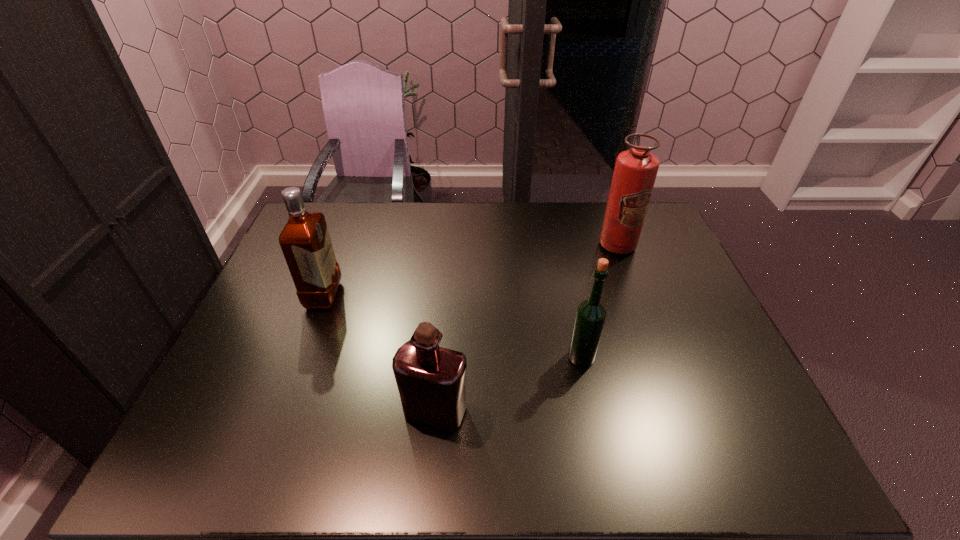
Identify which object is the third closest to the rightmost liquor. Please provide its 2D coordinates. Your answer should be formatted as a tuple, i.e. [(x, y)], where the tuple contains the x and y coordinates of a point satisfying the conditions above.

[(305, 241)]

Locate which object ranks third in proximity to the farthest object. Please provide its 2D coordinates. Your answer should be formatted as a tuple, i.e. [(x, y)], where the tuple contains the x and y coordinates of a point satisfying the conditions above.

[(305, 241)]

Where is `the closest liquor to the leftmost object`? The height and width of the screenshot is (540, 960). the closest liquor to the leftmost object is located at coordinates (431, 380).

Where is `liquor identified as the second closest to the third object from left to right`? The image size is (960, 540). liquor identified as the second closest to the third object from left to right is located at coordinates (305, 241).

The width and height of the screenshot is (960, 540). I want to click on free region that satisfies the following two spatial constraints: 1. on the front label of the leftmost liquor; 2. on the back side of the third object from left to right, so [x=300, y=357].

Identify the location of vacant area in the image that satisfies the following two spatial constraints: 1. on the label side of the fire extinguisher; 2. on the front label of the leftmost object. (636, 295).

Where is `free space that satisfies the following two spatial constraints: 1. on the front label of the rightmost liquor; 2. on the left side of the leftmost liquor`? This screenshot has height=540, width=960. free space that satisfies the following two spatial constraints: 1. on the front label of the rightmost liquor; 2. on the left side of the leftmost liquor is located at coordinates coord(300,357).

Locate an element on the screen. Image resolution: width=960 pixels, height=540 pixels. free space that satisfies the following two spatial constraints: 1. on the front label of the leftmost liquor; 2. on the left side of the second nearest object is located at coordinates (300, 357).

The width and height of the screenshot is (960, 540). I want to click on vacant area that satisfies the following two spatial constraints: 1. on the front label of the leftmost liquor; 2. on the back side of the second object from left to right, so click(280, 411).

This screenshot has width=960, height=540. In order to click on vacant point that satisfies the following two spatial constraints: 1. on the front label of the second farthest liquor; 2. on the right side of the leftmost liquor in this screenshot , I will do `click(300, 357)`.